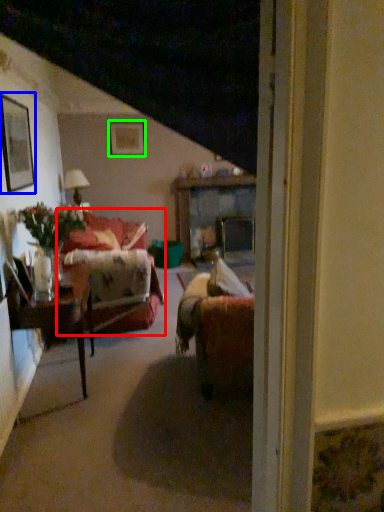
Question: Which object is positioned closest to studio couch (highlighted by a red box)? Select from picture frame (highlighted by a blue box) and picture frame (highlighted by a green box).

Choices:
 (A) picture frame
 (B) picture frame

Answer: (A)